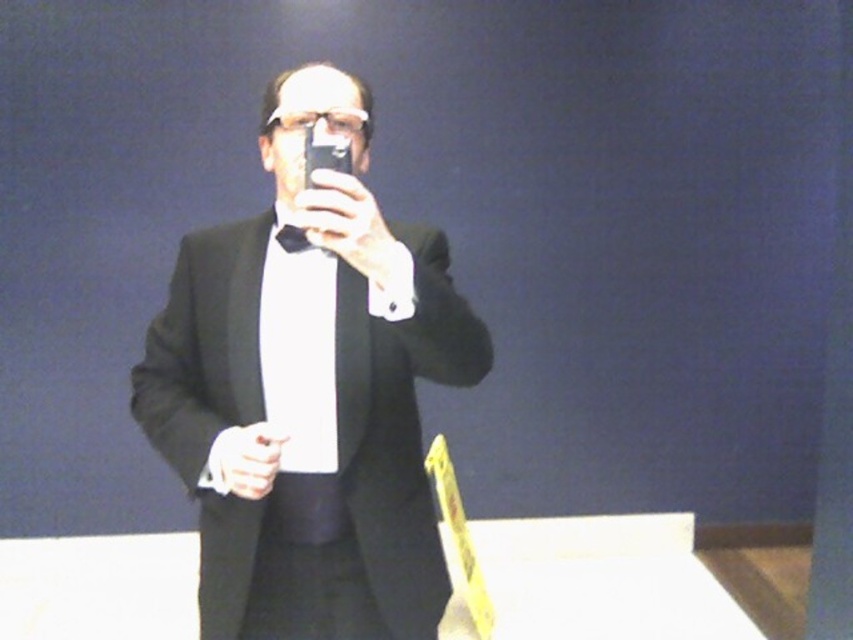
Where is the black matte suit at center located in the image?

The black matte suit at center is located at point (309, 392).

You are a photographer adjusting the lighting for a portrait. You notice the black matte suit at center and the black satin bow tie at center in the frame. Which object is positioned lower in the image?

The black matte suit at center is located below the black satin bow tie at center, so the black matte suit at center is positioned lower in the image.

You are a photographer adjusting the focus on your camera. You notice the black matte suit at center and the black satin bow tie at center in the frame. Which object should you focus on first if you want the closer object to be sharp?

The black matte suit at center is closer to the viewer than the black satin bow tie at center, so you should focus on the black matte suit at center first to ensure it is sharp.